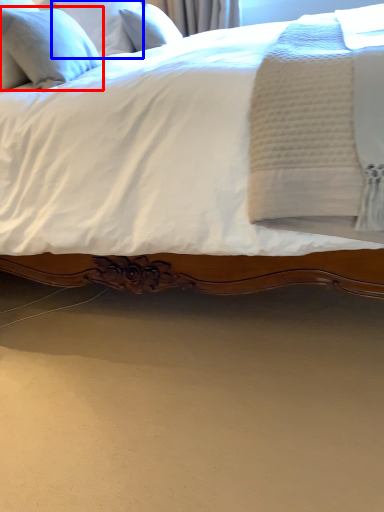
Question: Which point is further to the camera, pillow (highlighted by a red box) or pillow (highlighted by a blue box)?

Choices:
 (A) pillow
 (B) pillow

Answer: (B)